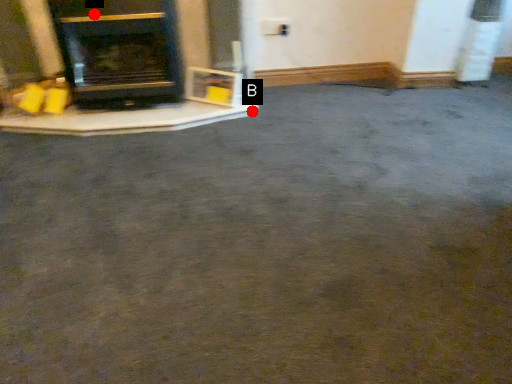
Question: Two points are circled on the image, labeled by A and B beside each circle. Which point is closer to the camera?

Choices:
 (A) A is closer
 (B) B is closer

Answer: (A)